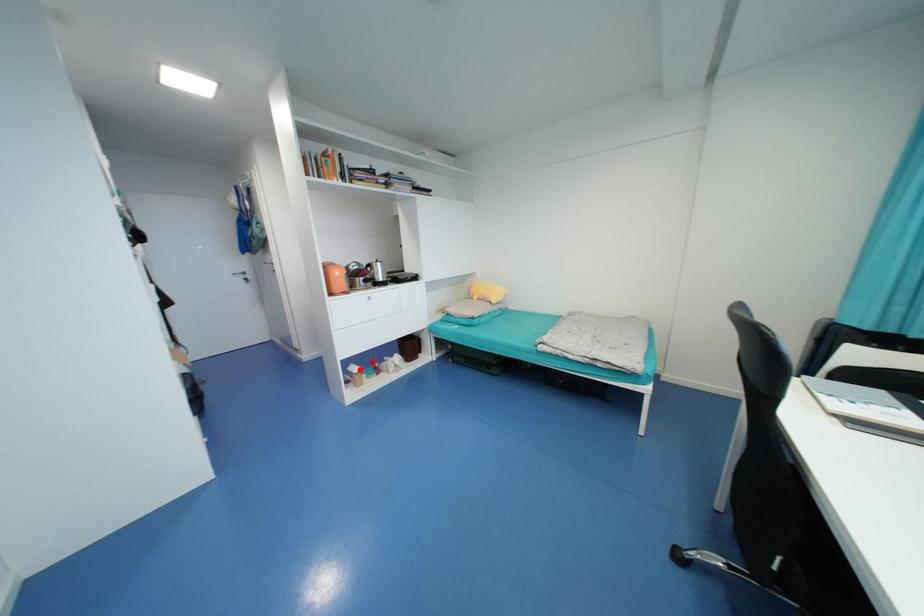
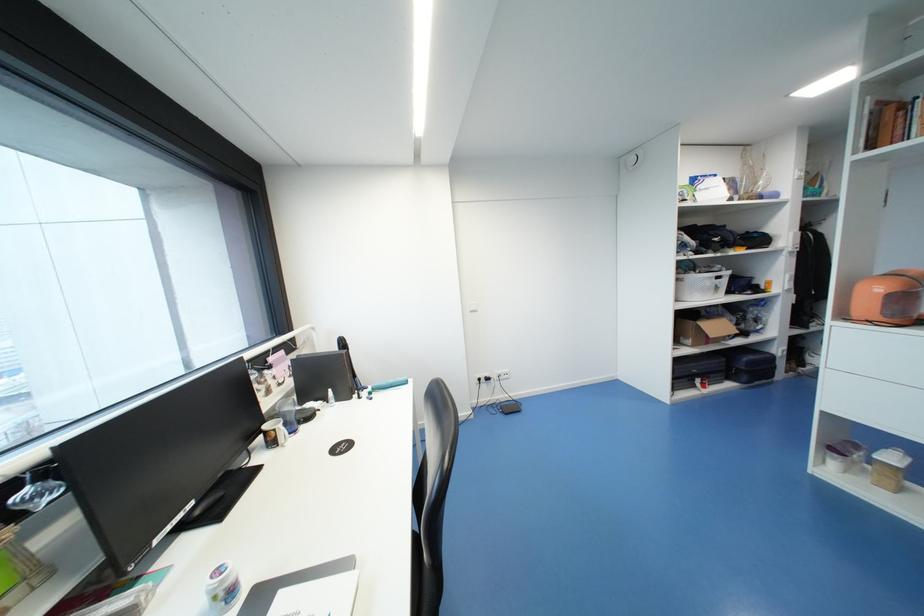
Where in the second image is the point corresponding to the highlighted location from the first image?

(897, 459)